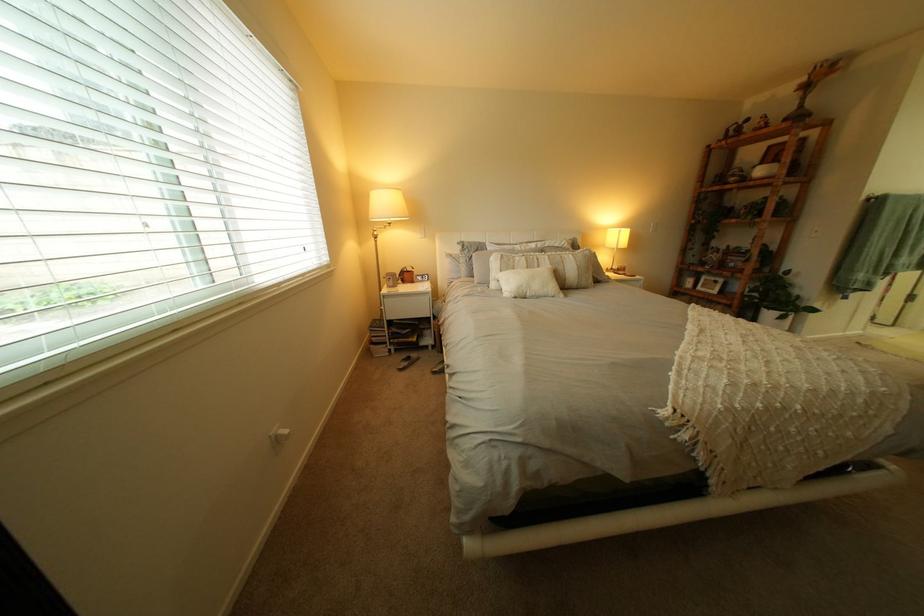
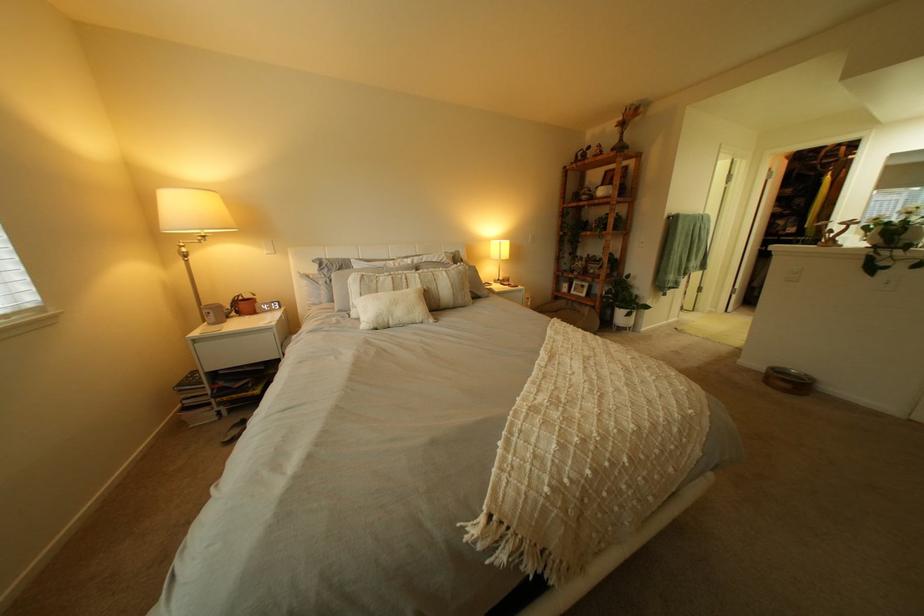
The point at [386,217] is marked in the first image. Where is the corresponding point in the second image?

(176, 229)